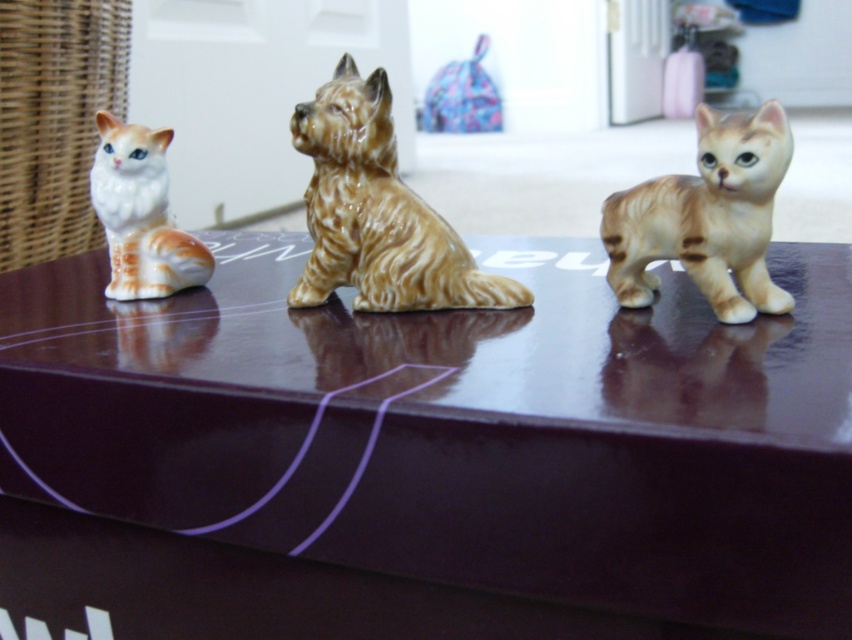
You are organizing a shelf and need to place a small decorative item between the matte orange cat at right and the white glossy cat at left. Given their sizes, which side should you place it closer to for balance?

The matte orange cat at right is bigger than the white glossy cat at left, so placing the decorative item closer to the white glossy cat at left would help balance the composition.

You are standing in front of three ceramic animal figurines on a dark wooden surface. You see a point labeled as point (373, 184) and another point labeled as point (737, 216). Which of these two points is closer to you?

Result: Point (373, 184) is further to the camera than point (737, 216), so the point closer to you is point (737, 216).